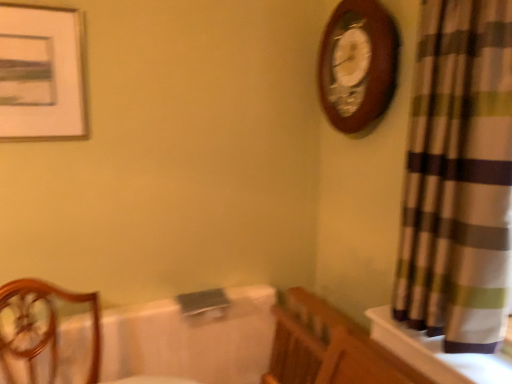
This screenshot has height=384, width=512. I want to click on free spot above white glossy bath at center (from a real-world perspective), so click(170, 300).